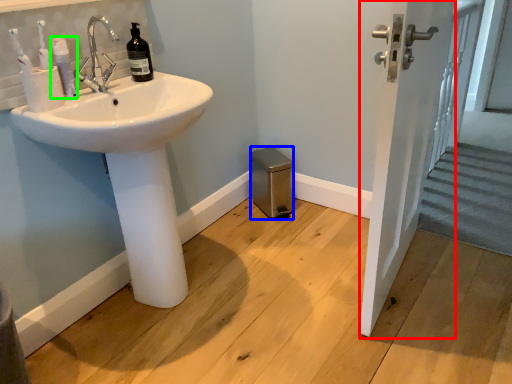
Question: Considering the real-world distances, which object is closest to screen door (highlighted by a red box)? bidet (highlighted by a blue box) or toiletry (highlighted by a green box).

Choices:
 (A) bidet
 (B) toiletry

Answer: (A)